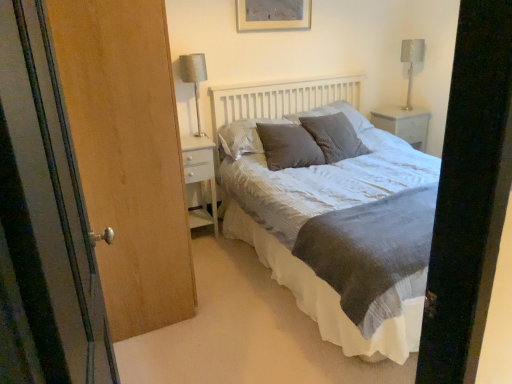
Question: In terms of height, does wooden screen door at left look taller or shorter compared to matte gray picture frame at upper center?

Choices:
 (A) short
 (B) tall

Answer: (B)

Question: Is wooden screen door at left in front of or behind matte gray picture frame at upper center in the image?

Choices:
 (A) front
 (B) behind

Answer: (A)

Question: Estimate the real-world distances between objects in this image. Which object is closer to the metallic silver table lamp at upper right, the 1th table lamp when ordered from back to front?

Choices:
 (A) matte gray picture frame at upper center
 (B) white wood nightstand at left, which appears as the 2th nightstand when viewed from the top
 (C) white wood nightstand at right, which is counted as the 1th nightstand, starting from the back
 (D) textured gray pillow at center, arranged as the first pillow when viewed from the left
 (E) gray textured pillow at center, which is the 2th pillow in left-to-right order

Answer: (C)

Question: Which is nearer to the textured gray pillow at center, arranged as the first pillow when viewed from the left?

Choices:
 (A) matte gray picture frame at upper center
 (B) wooden screen door at left
 (C) white wood nightstand at left, arranged as the first nightstand when viewed from the left
 (D) metallic silver table lamp at upper right, placed as the 2th table lamp when sorted from front to back
 (E) silver metallic table lamp at left, which appears as the first table lamp when viewed from the front

Answer: (C)